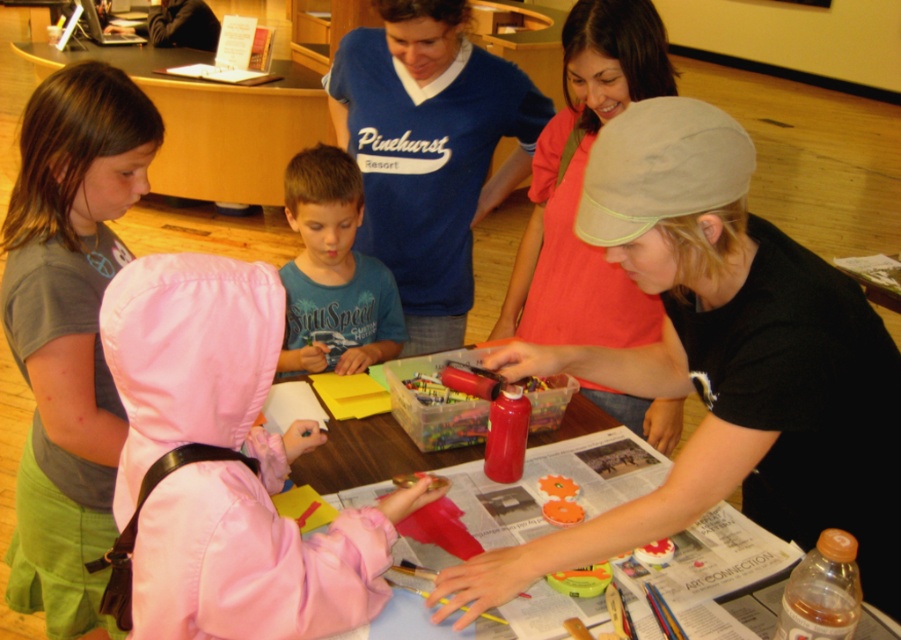
Who is more forward, (704,448) or (507,608)?

Point (704,448)

Who is positioned more to the left, matte black cap at upper right or translucent plastic table at center?

translucent plastic table at center is more to the left.

Who is more distant from viewer, (616, 365) or (463, 445)?

The point (463, 445) is behind.

This screenshot has height=640, width=901. In order to click on matte black cap at upper right in this screenshot , I will do `click(721, 362)`.

Is wooden table at lower center in front of blue cotton shirt at center?

No, it is behind blue cotton shirt at center.

Does wooden table at lower center have a lesser width compared to blue cotton shirt at center?

In fact, wooden table at lower center might be wider than blue cotton shirt at center.

What do you see at coordinates (214, 122) in the screenshot? I see `wooden table at lower center` at bounding box center [214, 122].

Identify the location of wooden table at lower center. This screenshot has height=640, width=901. (214, 122).

Does matte pink hoodie at center have a greater width compared to translucent plastic table at center?

In fact, matte pink hoodie at center might be narrower than translucent plastic table at center.

Can you confirm if matte pink hoodie at center is positioned above translucent plastic table at center?

Correct, matte pink hoodie at center is located above translucent plastic table at center.

What are the coordinates of `matte pink hoodie at center` in the screenshot? It's located at (581, 184).